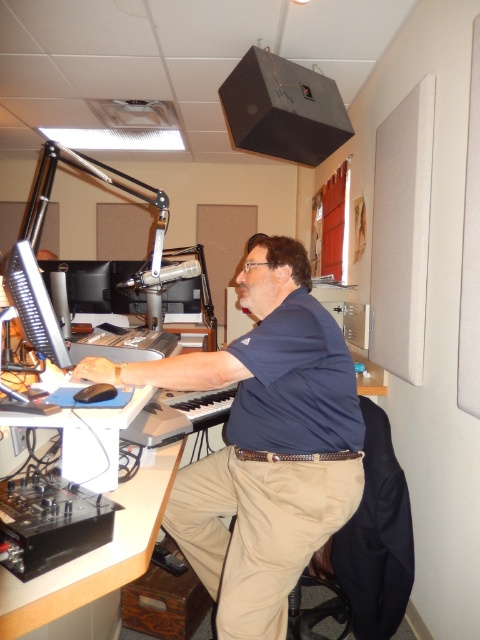
You are setting up a new monitor for a radio host. The current setup includes a white plastic computer desk at lower left and a matte black monitor at left. Which object has a greater width?

The white plastic computer desk at lower left has a greater width than the matte black monitor at left.

You are a visitor in the studio and want to sit down. The black mesh swivel chair at lower right is located at point (x=364, y=548). Is the chair positioned to the right or left of the microphone on the stand?

The black mesh swivel chair at lower right is located at point (x=364, y=548), which is to the right of the microphone on the stand.

Where is the dark blue shirt at center located in the image?

The dark blue shirt at center is located at point 0.695 on the x axis and 0.550 on the y axis.